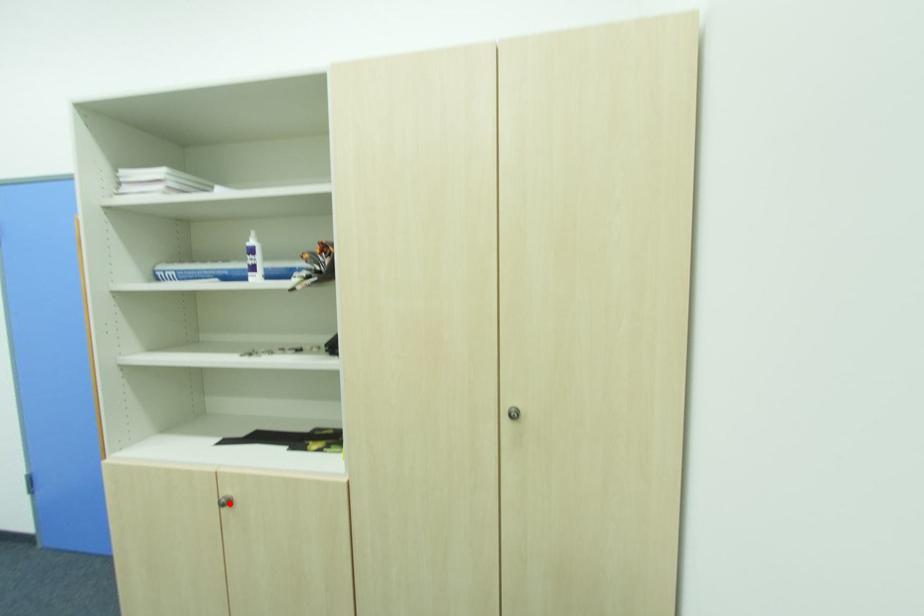
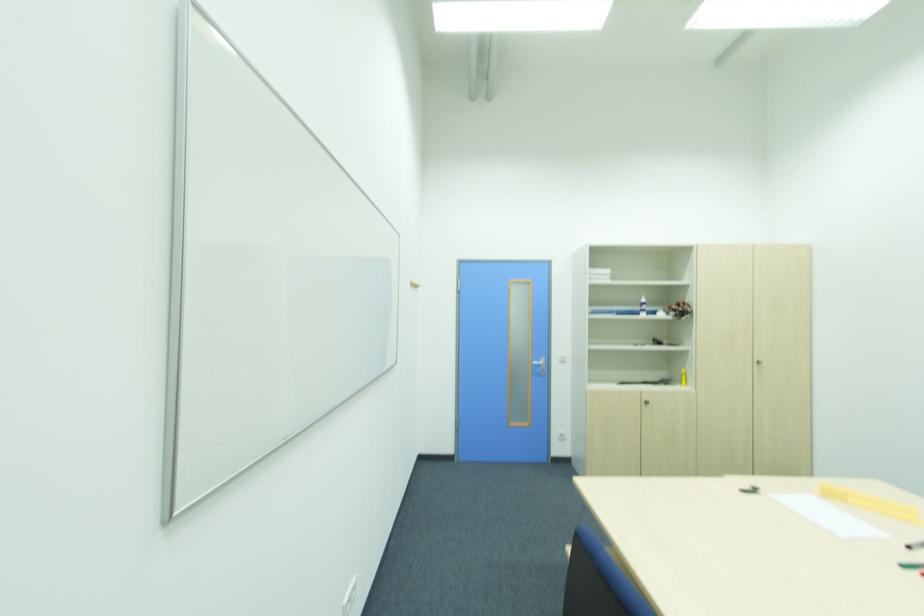
Question: I am providing you with two images of the same scene from different viewpoints. In image1, a red point is highlighted. Considering the same 3D point in image2, which of the following is correct?

Choices:
 (A) It is closer
 (B) It is farther

Answer: (B)